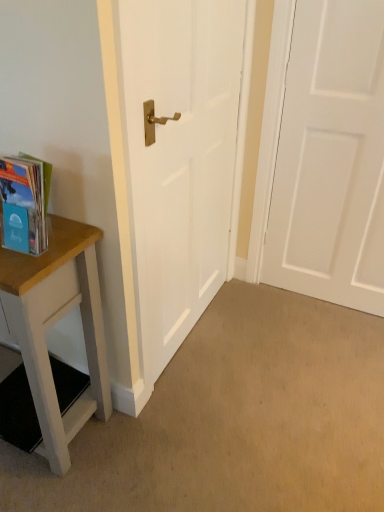
Question: Could you tell me if translucent plastic book at left is turned towards white matte door at center, which appears as the 2th door when viewed from the right?

Choices:
 (A) no
 (B) yes

Answer: (A)

Question: Does translucent plastic book at left have a greater width compared to white matte door at center, which appears as the 2th door when viewed from the right?

Choices:
 (A) yes
 (B) no

Answer: (A)

Question: Can you confirm if translucent plastic book at left is thinner than white matte door at center, which appears as the 2th door when viewed from the right?

Choices:
 (A) no
 (B) yes

Answer: (A)

Question: Is translucent plastic book at left smaller than white matte door at center, which is the 1th door in left-to-right order?

Choices:
 (A) yes
 (B) no

Answer: (A)

Question: Considering the relative sizes of translucent plastic book at left and white matte door at center, which is the 1th door in left-to-right order, in the image provided, is translucent plastic book at left bigger than white matte door at center, which is the 1th door in left-to-right order,?

Choices:
 (A) yes
 (B) no

Answer: (B)

Question: Is translucent plastic book at left next to white matte door at center, which appears as the 2th door when viewed from the right, and touching it?

Choices:
 (A) yes
 (B) no

Answer: (B)

Question: Is wooden table at left at the back of white matte door at center, which appears as the 2th door when viewed from the right?

Choices:
 (A) no
 (B) yes

Answer: (A)

Question: Can you confirm if white matte door at center, which is the 1th door in left-to-right order, is smaller than wooden table at left?

Choices:
 (A) no
 (B) yes

Answer: (B)

Question: Considering the relative sizes of white matte door at center, which is the 1th door in left-to-right order, and wooden table at left in the image provided, is white matte door at center, which is the 1th door in left-to-right order, thinner than wooden table at left?

Choices:
 (A) no
 (B) yes

Answer: (B)

Question: Is white matte door at center, which appears as the 2th door when viewed from the right, bigger than wooden table at left?

Choices:
 (A) no
 (B) yes

Answer: (A)

Question: Is the surface of white matte door at center, which appears as the 2th door when viewed from the right, in direct contact with wooden table at left?

Choices:
 (A) yes
 (B) no

Answer: (B)

Question: Is white matte door at right, which is the 1th door from right to left, at the back of white matte door at center, which appears as the 2th door when viewed from the right?

Choices:
 (A) yes
 (B) no

Answer: (B)